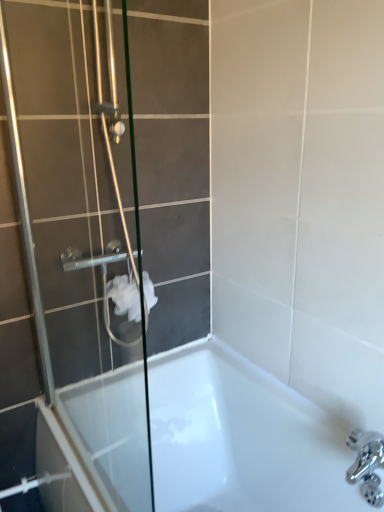
What is the approximate width of white matte toilet paper at center?

It is 6.09 inches.

In order to face white glossy bathtub at lower center, should I rotate leftwards or rightwards?

A 0.746 degree turn to the right will do.

The image size is (384, 512). I want to click on white matte toilet paper at center, so 125,297.

The height and width of the screenshot is (512, 384). What are the coordinates of `toilet paper behind the clear glass shower door at left` in the screenshot? It's located at (125, 297).

Are white matte toilet paper at center and clear glass shower door at left located far from each other?

They are positioned close to each other.

How different are the orientations of white matte toilet paper at center and clear glass shower door at left in degrees?

The angular difference between white matte toilet paper at center and clear glass shower door at left is 89 degrees.

Does point (144, 270) appear closer or farther from the camera than point (110, 63)?

Clearly, point (144, 270) is more distant from the camera than point (110, 63).

Who is taller, white glossy bathtub at lower center or clear glass shower door at left?

clear glass shower door at left is taller.

In the image, there is a clear glass shower door at left. At what (x,y) coordinates should I click in order to perform the action: click on bathtub below it (from a real-world perspective). Please return your answer as a coordinate pair (x, y). Looking at the image, I should click on (242, 438).

Does point (340, 490) lie behind point (65, 372)?

No, (340, 490) is in front of (65, 372).

Can clear glass shower door at left be found inside white glossy bathtub at lower center?

Definitely not — clear glass shower door at left is not inside white glossy bathtub at lower center.

Which of these two, clear glass shower door at left or white matte toilet paper at center, is wider?

With larger width is white matte toilet paper at center.

How many degrees apart are the facing directions of clear glass shower door at left and white matte toilet paper at center?

There is a 89-degree angle between the facing directions of clear glass shower door at left and white matte toilet paper at center.

Considering the relative sizes of clear glass shower door at left and white matte toilet paper at center in the image provided, is clear glass shower door at left smaller than white matte toilet paper at center?

No.

Could you tell me if clear glass shower door at left is turned towards white matte toilet paper at center?

No, clear glass shower door at left is not aimed at white matte toilet paper at center.

Is white matte toilet paper at center not near white glossy bathtub at lower center?

No.

Is white glossy bathtub at lower center at the back of white matte toilet paper at center?

No, white matte toilet paper at center's orientation is not away from white glossy bathtub at lower center.

Is point (123, 281) positioned in front of point (203, 475)?

Yes.

Based on the photo, from the image's perspective, is white matte toilet paper at center above or below white glossy bathtub at lower center?

From the image's perspective, white matte toilet paper at center appears above white glossy bathtub at lower center.

Considering the relative positions of white glossy bathtub at lower center and white matte toilet paper at center in the image provided, is white glossy bathtub at lower center in front of white matte toilet paper at center?

Yes, it is in front of white matte toilet paper at center.

Considering the points (297, 489) and (129, 312), which point is behind, point (297, 489) or point (129, 312)?

Point (129, 312)

Is white glossy bathtub at lower center to the left or to the right of white matte toilet paper at center in the image?

white glossy bathtub at lower center is positioned on white matte toilet paper at center's right side.

From the image's perspective, between clear glass shower door at left and white glossy bathtub at lower center, which one is located above?

clear glass shower door at left appears higher in the image.

Locate an element on the screen. The image size is (384, 512). shower door that appears on the left of white glossy bathtub at lower center is located at coordinates (78, 248).

From a real-world perspective, does clear glass shower door at left sit lower than white glossy bathtub at lower center?

No, from a real-world perspective, clear glass shower door at left is not below white glossy bathtub at lower center.

In the scene shown: What's the angular difference between clear glass shower door at left and white glossy bathtub at lower center's facing directions?

1.11 degrees.

The height and width of the screenshot is (512, 384). Identify the location of toilet paper beneath the clear glass shower door at left (from a real-world perspective). (125, 297).

Where is `bathtub that is below the clear glass shower door at left (from the image's perspective)`? bathtub that is below the clear glass shower door at left (from the image's perspective) is located at coordinates (242, 438).

Which object lies further to the anchor point white glossy bathtub at lower center, white matte toilet paper at center or clear glass shower door at left?

The object further to white glossy bathtub at lower center is white matte toilet paper at center.

In the scene shown: From the image, which object appears to be farther from white matte toilet paper at center, white glossy bathtub at lower center or clear glass shower door at left?

The object further to white matte toilet paper at center is white glossy bathtub at lower center.

Estimate the real-world distances between objects in this image. Which object is closer to white matte toilet paper at center, clear glass shower door at left or white glossy bathtub at lower center?

Based on the image, clear glass shower door at left appears to be nearer to white matte toilet paper at center.

From the image, which object appears to be farther from white glossy bathtub at lower center, clear glass shower door at left or white matte toilet paper at center?

white matte toilet paper at center is further to white glossy bathtub at lower center.

Based on their spatial positions, is white matte toilet paper at center or white glossy bathtub at lower center closer to clear glass shower door at left?

Among the two, white matte toilet paper at center is located nearer to clear glass shower door at left.

Based on their spatial positions, is white glossy bathtub at lower center or white matte toilet paper at center closer to clear glass shower door at left?

white matte toilet paper at center.

At what (x,y) coordinates should I click in order to perform the action: click on bathtub between clear glass shower door at left and white matte toilet paper at center along the z-axis. Please return your answer as a coordinate pair (x, y). This screenshot has width=384, height=512. Looking at the image, I should click on (242, 438).